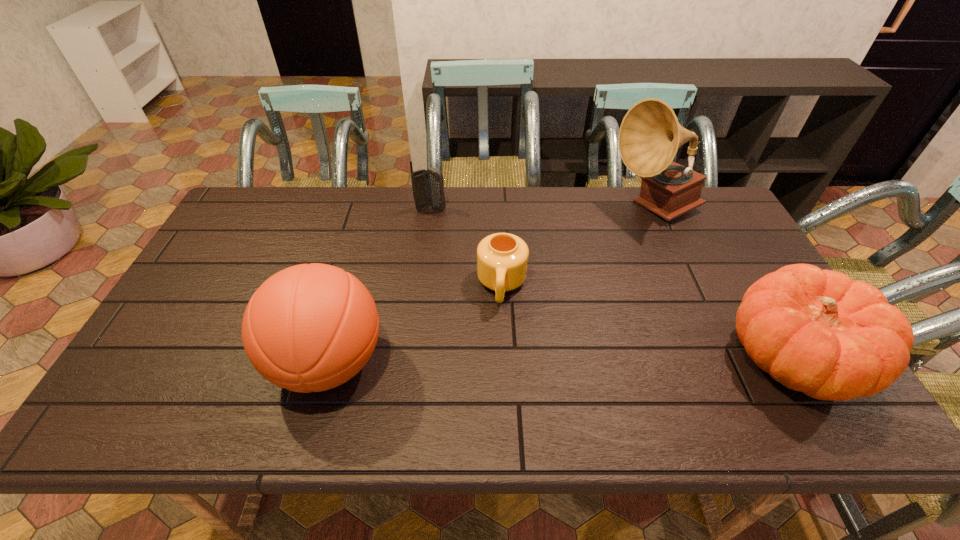
Image resolution: width=960 pixels, height=540 pixels. I want to click on basketball that is at the near edge, so click(308, 328).

Image resolution: width=960 pixels, height=540 pixels. What are the coordinates of `pumpkin that is positioned at the near edge` in the screenshot? It's located at (816, 331).

Identify the location of pumpkin at the right edge. This screenshot has height=540, width=960. (816, 331).

Where is `phonograph record located at the right edge`? Image resolution: width=960 pixels, height=540 pixels. phonograph record located at the right edge is located at coordinates (650, 135).

Where is `object located at the far right corner`? The image size is (960, 540). object located at the far right corner is located at coordinates [x=650, y=135].

Identify the location of object located at the near right corner. (816, 331).

Image resolution: width=960 pixels, height=540 pixels. Find the location of `free space at the far edge of the desktop`. free space at the far edge of the desktop is located at coordinates (304, 195).

Find the location of a particular element. Image resolution: width=960 pixels, height=540 pixels. vacant space at the near edge of the desktop is located at coordinates (530, 363).

In the image, there is a desktop. At what (x,y) coordinates should I click in order to perform the action: click on free space at the left edge. Please return your answer as a coordinate pair (x, y). The height and width of the screenshot is (540, 960). Looking at the image, I should click on (221, 259).

I want to click on blank space at the right edge of the desktop, so click(x=717, y=261).